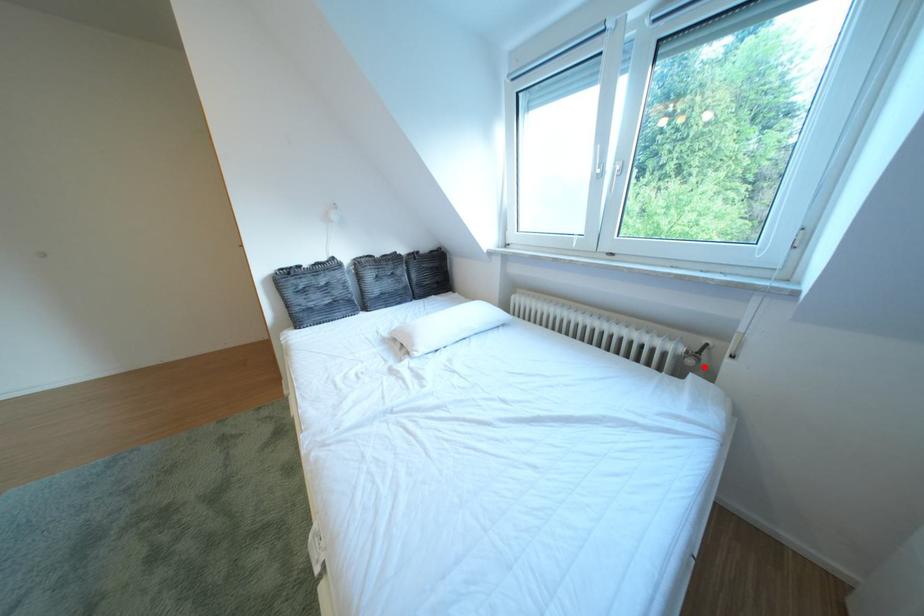
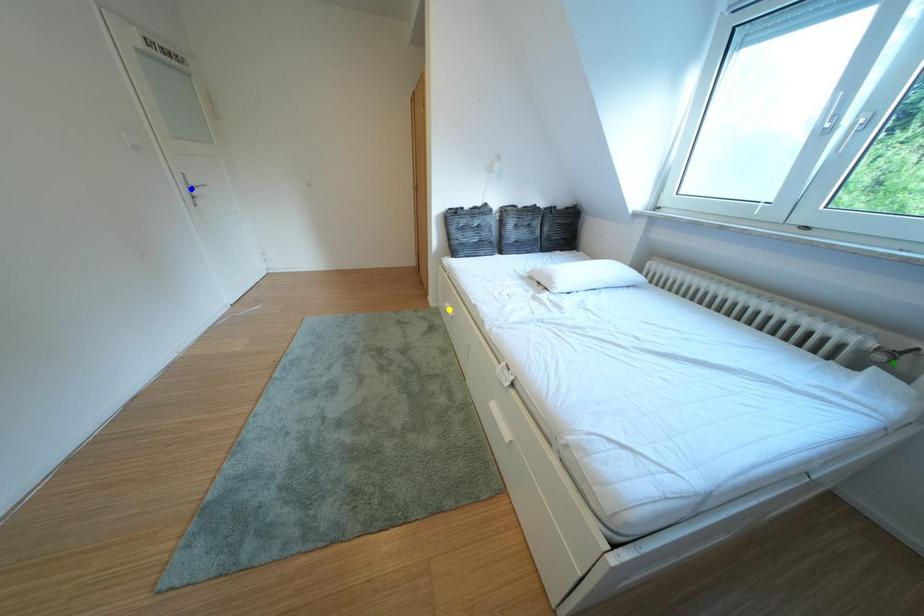
Question: I am providing you with two images of the same scene from different viewpoints. A red point is marked on the first image. You are given multiple points on the second image. In image 2, which mark is for the same physical point as the one in image 1?

Choices:
 (A) yellow point
 (B) green point
 (C) blue point

Answer: (B)